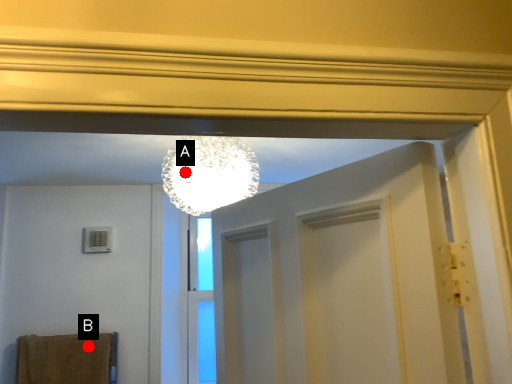
Question: Two points are circled on the image, labeled by A and B beside each circle. Which point is closer to the camera?

Choices:
 (A) A is closer
 (B) B is closer

Answer: (A)